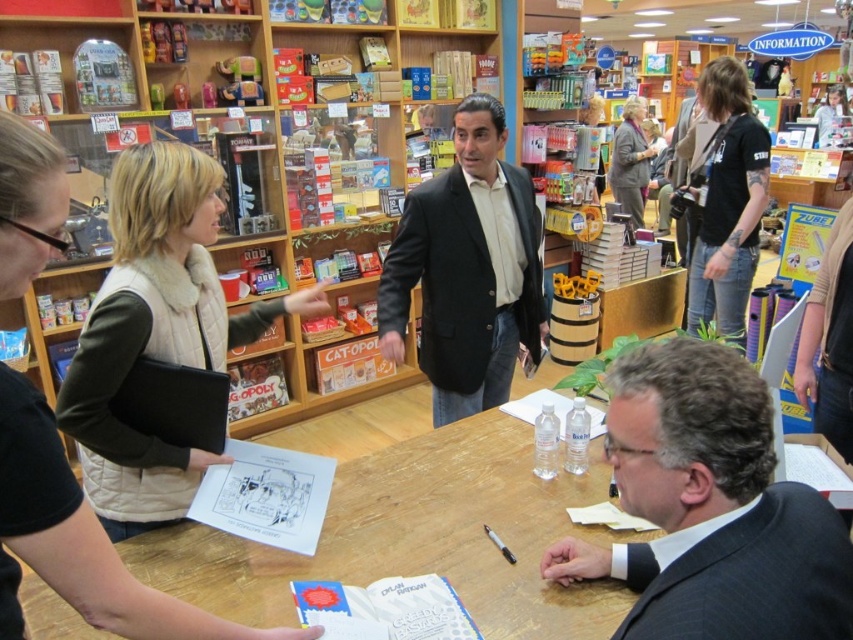
Question: Observing the image, what is the correct spatial positioning of dark suit at center in reference to dark gray suit at lower right?

Choices:
 (A) above
 (B) below

Answer: (A)

Question: Which object is closer to the camera taking this photo?

Choices:
 (A) black matte suit at center
 (B) wooden table at center

Answer: (B)

Question: Considering the real-world distances, which object is closest to the black matte suit at center?

Choices:
 (A) black cotton t-shirt at upper right
 (B) beige quilted vest at upper left
 (C) dark suit at center

Answer: (B)

Question: Which of the following is the closest to the observer?

Choices:
 (A) wooden bookshelf at center
 (B) black matte suit at center
 (C) beige quilted vest at upper left

Answer: (C)

Question: From the image, what is the correct spatial relationship of dark suit at center in relation to black cotton t-shirt at upper right?

Choices:
 (A) below
 (B) above

Answer: (A)

Question: Can you confirm if dark suit at center is positioned to the left of black cotton t-shirt at upper right?

Choices:
 (A) yes
 (B) no

Answer: (A)